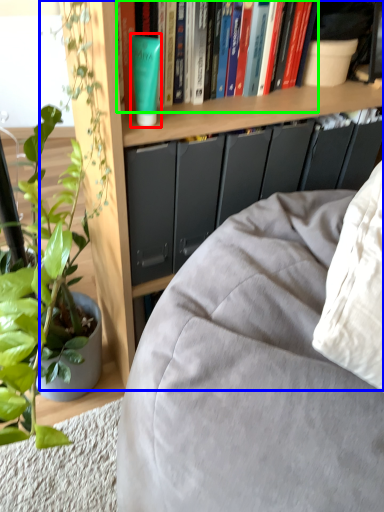
Question: Which object is the closest to the paperback book (highlighted by a red box)? Choose among these: bookcase (highlighted by a blue box) or book (highlighted by a green box).

Choices:
 (A) bookcase
 (B) book

Answer: (B)